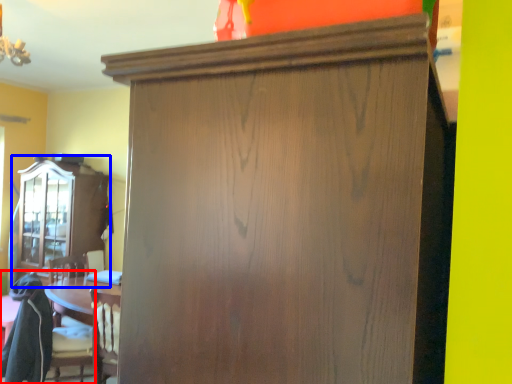
Question: Which object is further to the camera taking this photo, swivel chair (highlighted by a red box) or cabinetry (highlighted by a blue box)?

Choices:
 (A) swivel chair
 (B) cabinetry

Answer: (B)